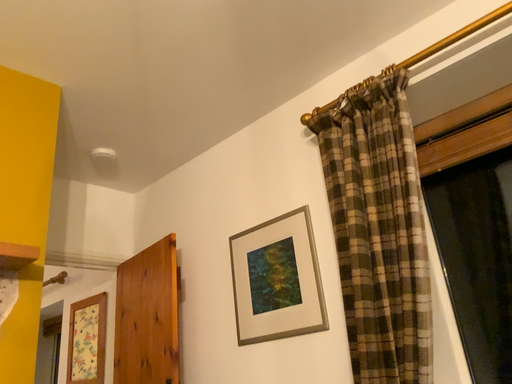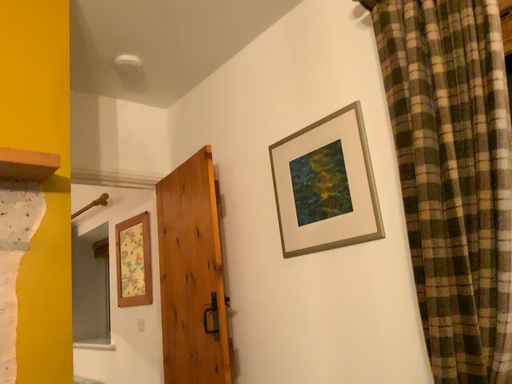
Question: Which way did the camera rotate in the video?

Choices:
 (A) rotated downward
 (B) rotated upward

Answer: (A)